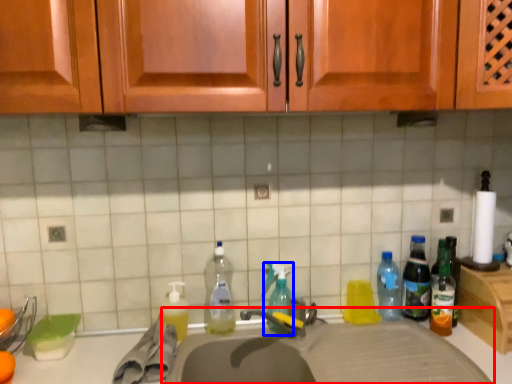
Question: Which point is closer to the camera, sink (highlighted by a red box) or bottle (highlighted by a blue box)?

Choices:
 (A) sink
 (B) bottle

Answer: (A)